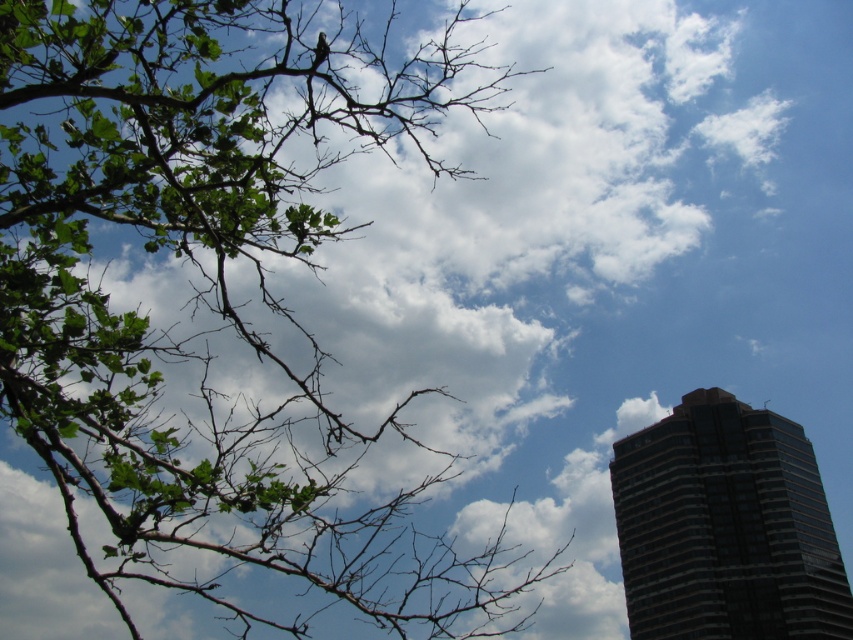
Is green leafy branches at upper left in front of dark glass building at right?

Yes.

Image resolution: width=853 pixels, height=640 pixels. What are the coordinates of `green leafy branches at upper left` in the screenshot? It's located at (213, 291).